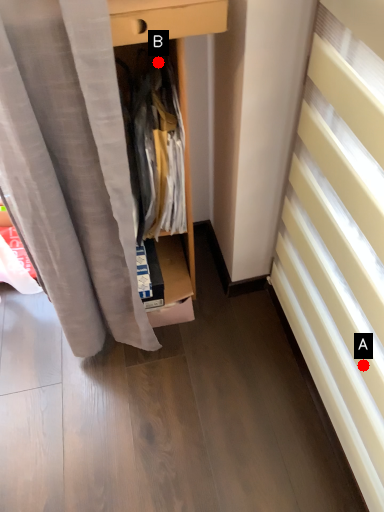
Question: Two points are circled on the image, labeled by A and B beside each circle. Which point is closer to the camera?

Choices:
 (A) A is closer
 (B) B is closer

Answer: (A)